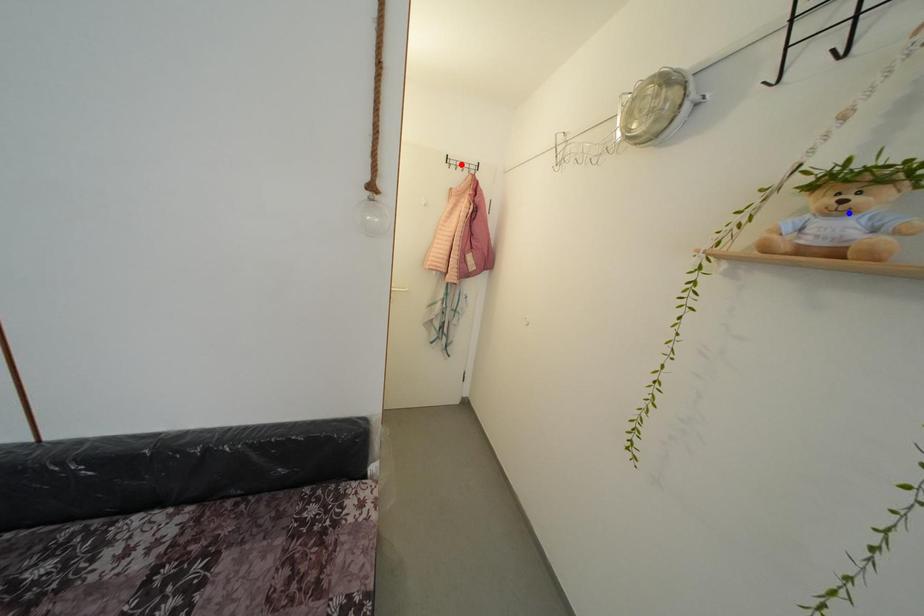
Question: Two points are marked on the image. Which point is closer to the camera?

Choices:
 (A) Blue point is closer.
 (B) Red point is closer.

Answer: (A)